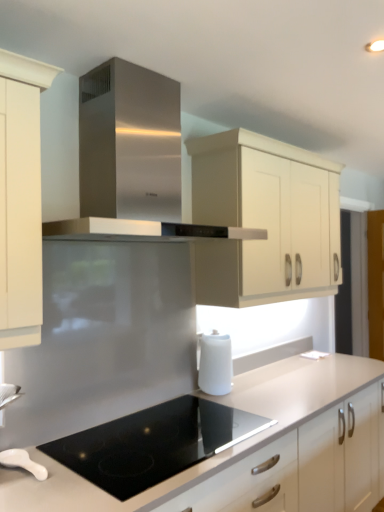
Question: From the image's perspective, is cream matte cabinet at upper center located beneath white matte countertop at center?

Choices:
 (A) yes
 (B) no

Answer: (B)

Question: Can you confirm if cream matte cabinet at upper center is bigger than white matte countertop at center?

Choices:
 (A) yes
 (B) no

Answer: (B)

Question: Would you say cream matte cabinet at upper center is a long distance from white matte countertop at center?

Choices:
 (A) yes
 (B) no

Answer: (B)

Question: Is cream matte cabinet at upper center directly adjacent to white matte countertop at center?

Choices:
 (A) no
 (B) yes

Answer: (A)

Question: Is cream matte cabinet at upper center positioned with its back to white matte countertop at center?

Choices:
 (A) no
 (B) yes

Answer: (A)

Question: From a real-world perspective, is white glossy spoon at lower left, the second kitchen appliance from the back, physically located above or below cream matte cabinet at upper center?

Choices:
 (A) below
 (B) above

Answer: (A)

Question: Is point (44, 470) positioned closer to the camera than point (248, 194)?

Choices:
 (A) farther
 (B) closer

Answer: (B)

Question: Is white glossy spoon at lower left, which is counted as the first kitchen appliance, starting from the bottom, inside the boundaries of cream matte cabinet at upper center, or outside?

Choices:
 (A) outside
 (B) inside

Answer: (A)

Question: Considering the positions of white glossy spoon at lower left, which is the first kitchen appliance from front to back, and cream matte cabinet at upper center in the image, is white glossy spoon at lower left, which is the first kitchen appliance from front to back, wider or thinner than cream matte cabinet at upper center?

Choices:
 (A) wide
 (B) thin

Answer: (B)

Question: From a real-world perspective, relative to black glass cooktop at center, is white matte countertop at center vertically above or below?

Choices:
 (A) below
 (B) above

Answer: (A)

Question: Is white matte countertop at center to the left or to the right of black glass cooktop at center in the image?

Choices:
 (A) left
 (B) right

Answer: (B)

Question: From the image's perspective, is white matte countertop at center above or below black glass cooktop at center?

Choices:
 (A) above
 (B) below

Answer: (B)

Question: Is white matte countertop at center in front of or behind black glass cooktop at center in the image?

Choices:
 (A) front
 (B) behind

Answer: (A)

Question: Is white matte kettle at lower center, positioned as the 1th kitchen appliance in right-to-left order, bigger or smaller than stainless steel range hood at center?

Choices:
 (A) big
 (B) small

Answer: (B)

Question: Considering the positions of white matte kettle at lower center, the 2th kitchen appliance in the bottom-to-top sequence, and stainless steel range hood at center in the image, is white matte kettle at lower center, the 2th kitchen appliance in the bottom-to-top sequence, wider or thinner than stainless steel range hood at center?

Choices:
 (A) wide
 (B) thin

Answer: (B)